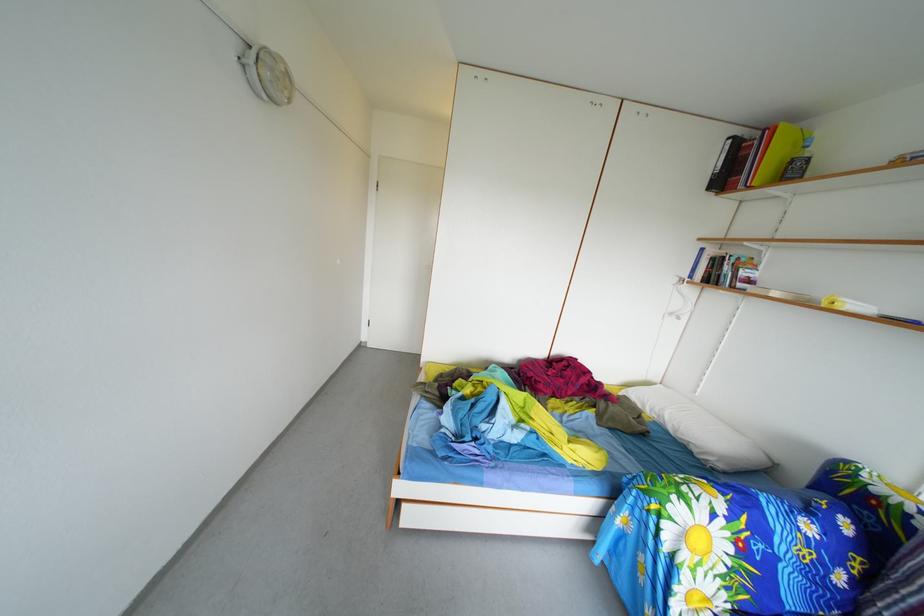
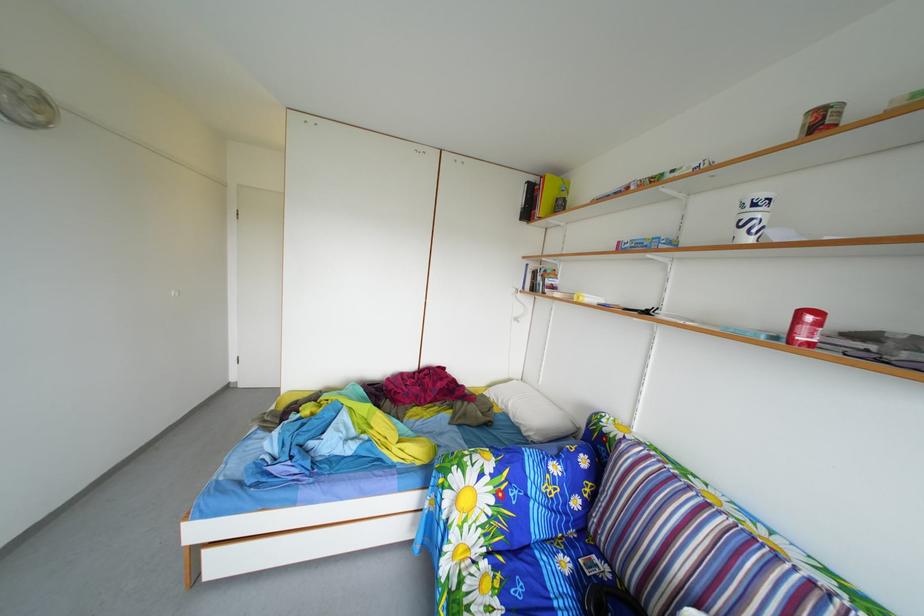
Locate, in the second image, the point that corresponds to the point at 723,171 in the first image.

(530, 208)